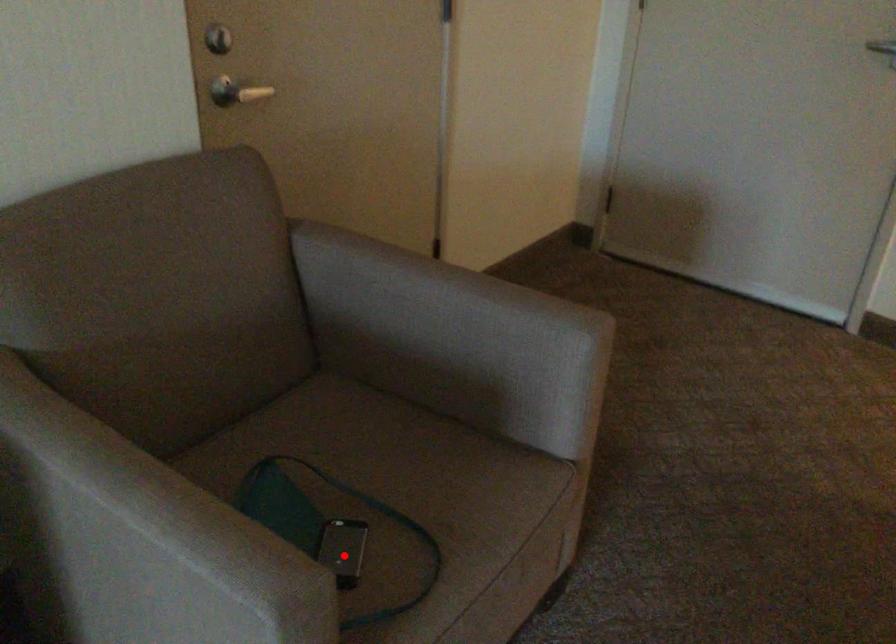
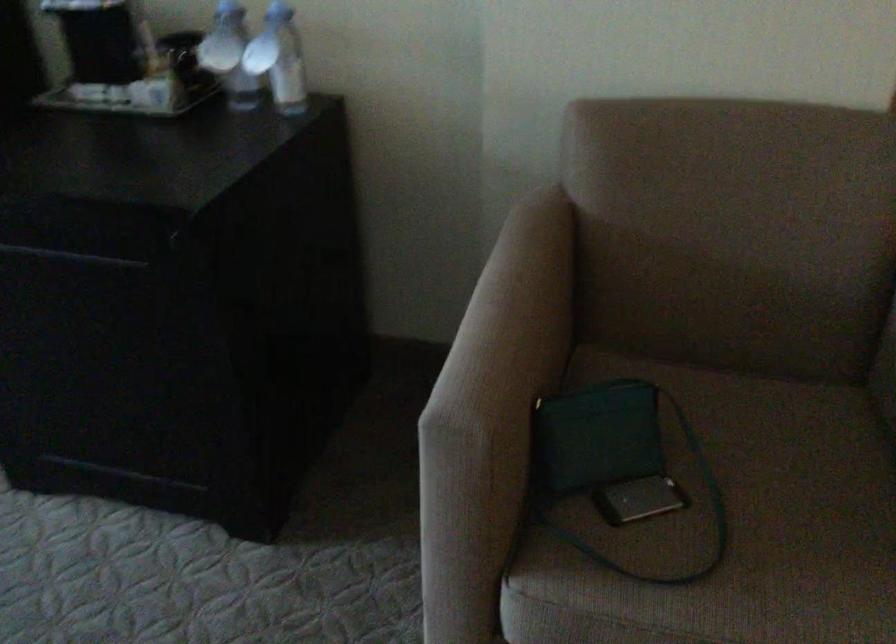
Locate, in the second image, the point that corresponds to the highlighted location in the first image.

(639, 500)